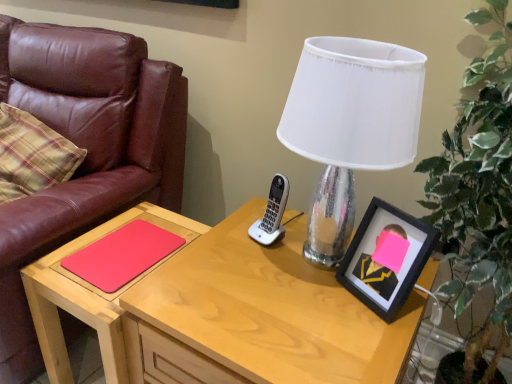
This screenshot has width=512, height=384. In order to click on free space above matte wood table at lower left (from a real-world perspective) in this screenshot , I will do `click(129, 245)`.